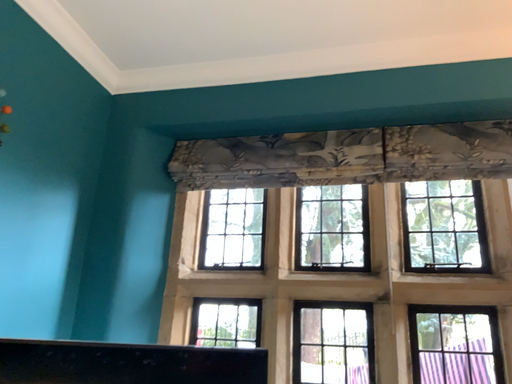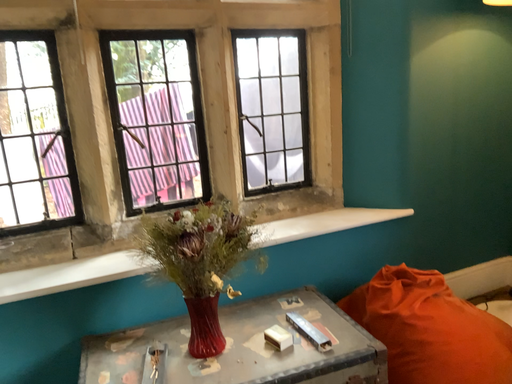
Question: Which way did the camera rotate in the video?

Choices:
 (A) rotated right
 (B) rotated left

Answer: (A)